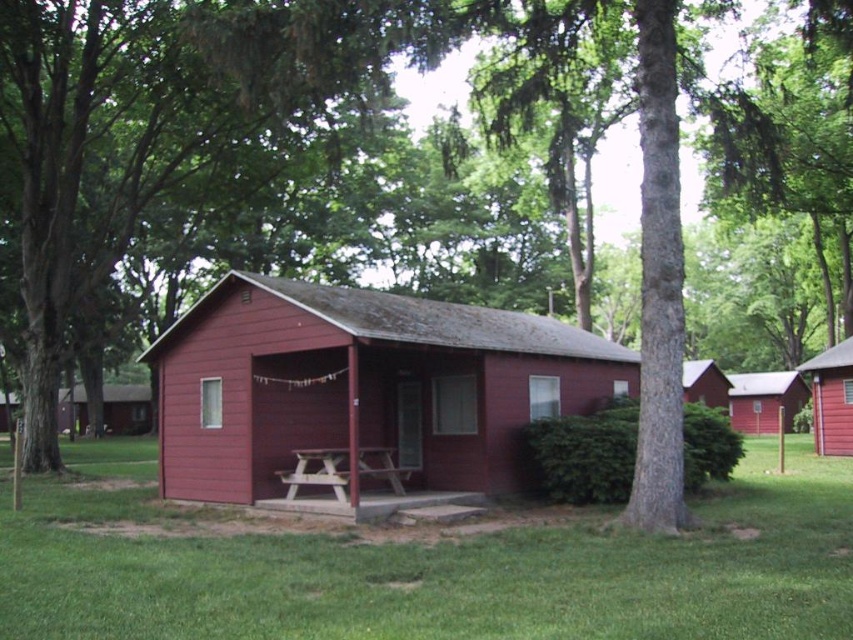
Does wooden picnic table at center have a lesser width compared to matte red cabin at center?

Yes.

Who is lower down, wooden picnic table at center or matte red cabin at center?

matte red cabin at center

Between point (299, 477) and point (107, 387), which one is positioned behind?

Point (107, 387)

This screenshot has width=853, height=640. Find the location of `wooden picnic table at center`. wooden picnic table at center is located at coordinates (317, 472).

How distant is green grass at lower center from wooden picnic table at center?

green grass at lower center is 13.43 feet away from wooden picnic table at center.

Is point (570, 554) positioned behind point (395, 490)?

No, it is not.

Between point (753, 483) and point (328, 472), which one is positioned behind?

Point (753, 483)

Where is `green grass at lower center`? The image size is (853, 640). green grass at lower center is located at coordinates (445, 572).

Can you confirm if green grass at lower center is thinner than matte red cabin at right?

No.

Between point (296, 586) and point (840, 422), which one is positioned in front?

Point (296, 586) is more forward.

Locate an element on the screen. Image resolution: width=853 pixels, height=640 pixels. green grass at lower center is located at coordinates (445, 572).